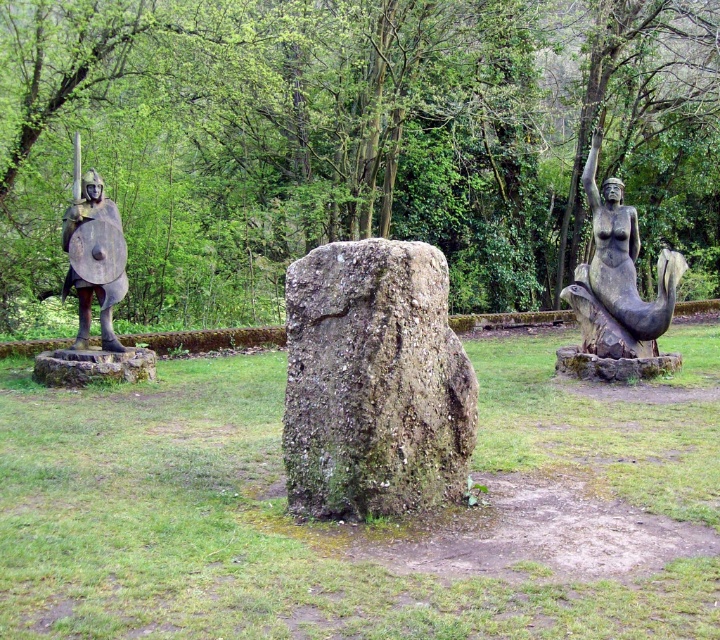
Question: Which of the following is the farthest from the observer?

Choices:
 (A) bronze warrior at left
 (B) green mossy rock at center

Answer: (A)

Question: Which point appears closest to the camera in this image?

Choices:
 (A) (607, 269)
 (B) (426, 436)

Answer: (B)

Question: Does bronze mermaid at right have a greater width compared to bronze warrior at left?

Choices:
 (A) no
 (B) yes

Answer: (B)

Question: Is green mossy rock at center below bronze mermaid at right?

Choices:
 (A) yes
 (B) no

Answer: (A)

Question: Which point is closer to the camera?

Choices:
 (A) green mossy rock at center
 (B) bronze mermaid at right

Answer: (A)

Question: Can you confirm if green mossy rock at center is wider than bronze warrior at left?

Choices:
 (A) yes
 (B) no

Answer: (A)